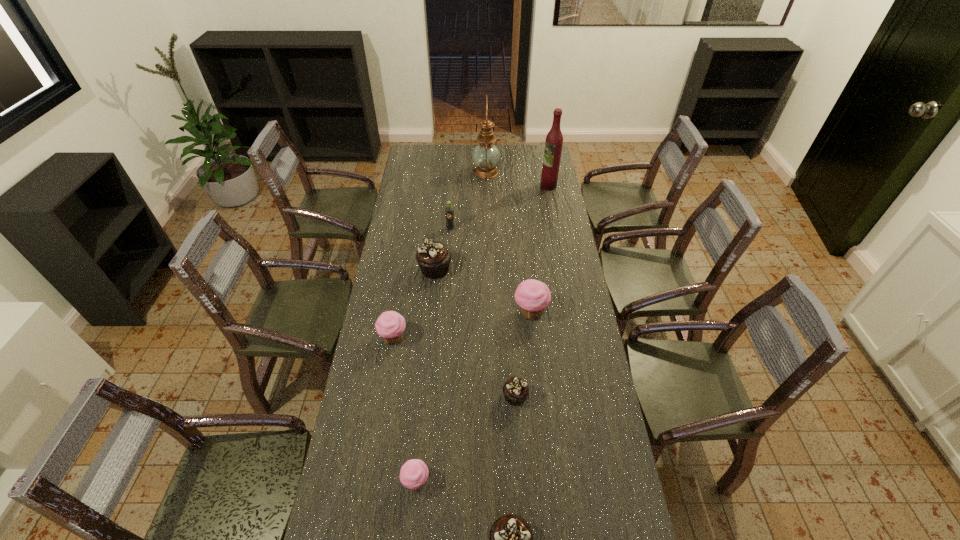
Locate an element on the screen. cupcake that stands as the closest to the soda is located at coordinates (433, 257).

Locate which cupcake is the third closest to the smallest pink cupcake. Please provide its 2D coordinates. Your answer should be formatted as a tuple, i.e. [(x, y)], where the tuple contains the x and y coordinates of a point satisfying the conditions above.

[(390, 325)]

Where is `the second closest brown cupcake to the oil lamp`? This screenshot has width=960, height=540. the second closest brown cupcake to the oil lamp is located at coordinates (515, 390).

Where is `the second closest brown cupcake relative to the second biggest pink cupcake`? The height and width of the screenshot is (540, 960). the second closest brown cupcake relative to the second biggest pink cupcake is located at coordinates click(515, 390).

Point out which pink cupcake is positioned as the nearest to the sixth farthest object. Please provide its 2D coordinates. Your answer should be formatted as a tuple, i.e. [(x, y)], where the tuple contains the x and y coordinates of a point satisfying the conditions above.

[(533, 296)]

Where is `the second closest pink cupcake relative to the fifth farthest cupcake`? The height and width of the screenshot is (540, 960). the second closest pink cupcake relative to the fifth farthest cupcake is located at coordinates (533, 296).

The height and width of the screenshot is (540, 960). I want to click on vacant point that satisfies the following two spatial constraints: 1. on the back side of the leftmost pink cupcake; 2. on the left side of the biggest pink cupcake, so click(397, 313).

You are a GUI agent. You are given a task and a screenshot of the screen. Output one action in this format:
    pyautogui.click(x=<x>, y=<y>)
    Task: Click on the vacant space that satisfies the following two spatial constraints: 1. on the front side of the smallest pink cupcake; 2. on the left side of the fourth farthest object
    
    Given the screenshot: What is the action you would take?
    pyautogui.click(x=414, y=482)